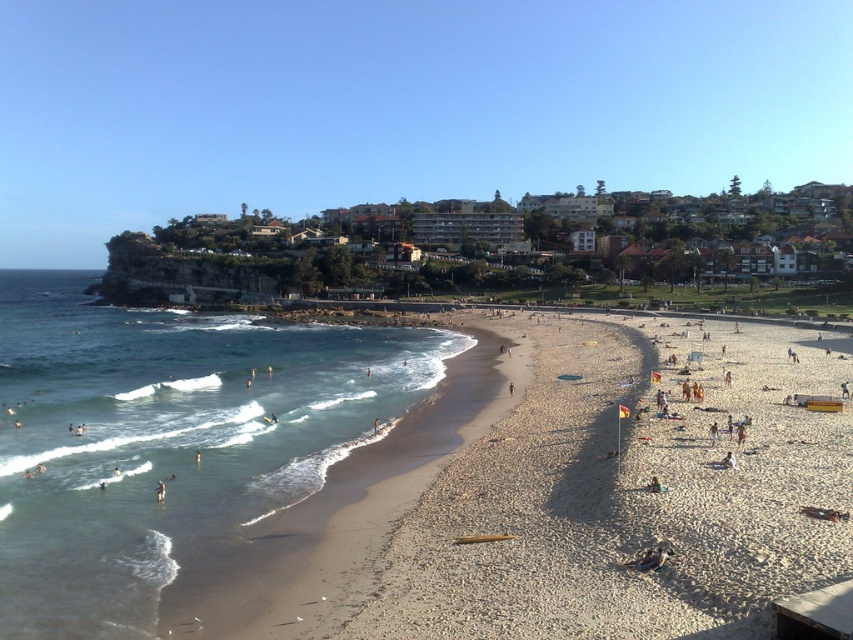
Between point (97, 380) and point (654, 483), which one is positioned in front?

Point (654, 483) is in front.

Does clear blue water at lower left lie behind green fabric person at lower right?

No, clear blue water at lower left is closer to the viewer.

Is point (281, 476) behind point (659, 481)?

Yes.

Locate an element on the screen. The image size is (853, 640). clear blue water at lower left is located at coordinates (166, 440).

Can you confirm if clear blue water at lower left is positioned to the left of dark brown leather bag at lower center?

Indeed, clear blue water at lower left is positioned on the left side of dark brown leather bag at lower center.

Between point (283, 433) and point (660, 554), which one is positioned in front?

Point (660, 554) is in front.

Identify the location of clear blue water at lower left. Image resolution: width=853 pixels, height=640 pixels. (166, 440).

Can you confirm if light brown gravel at center is shorter than clear blue water at lower left?

Yes, light brown gravel at center is shorter than clear blue water at lower left.

Between light brown gravel at center and clear blue water at lower left, which one appears on the left side from the viewer's perspective?

From the viewer's perspective, clear blue water at lower left appears more on the left side.

Who is more forward, (389,545) or (137,380)?

Point (389,545) is more forward.

The image size is (853, 640). I want to click on light brown gravel at center, so click(627, 500).